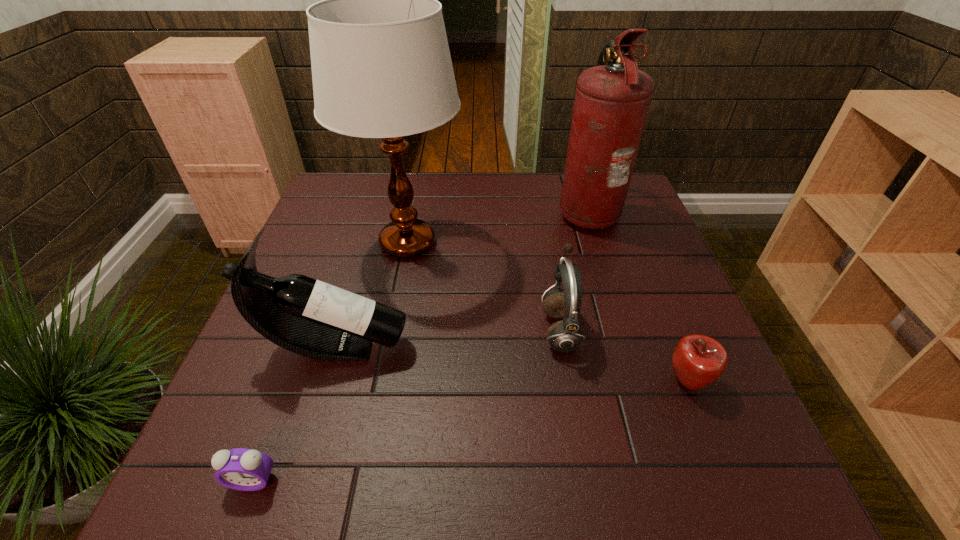
This screenshot has width=960, height=540. In order to click on blank space located at the front of the fire extinguisher where the nozzle is aimed in this screenshot , I will do `click(425, 211)`.

This screenshot has height=540, width=960. What are the coordinates of `vacant space located at the front of the fire extinguisher where the nozzle is aimed` in the screenshot? It's located at (510, 211).

I want to click on blank space located at the front of the fire extinguisher where the nozzle is aimed, so click(x=432, y=211).

You are a GUI agent. You are given a task and a screenshot of the screen. Output one action in this format:
    pyautogui.click(x=<x>, y=<y>)
    Task: Click on the free space located 0.100m on the stand of the fourth shortest object
    
    Given the screenshot: What is the action you would take?
    pyautogui.click(x=457, y=347)

I want to click on vacant space located 0.180m on the ear pads of the fourth tallest object, so click(460, 329).

Where is `vacant position located on the ear pads of the fourth tallest object`? This screenshot has height=540, width=960. vacant position located on the ear pads of the fourth tallest object is located at coordinates (446, 329).

The height and width of the screenshot is (540, 960). I want to click on vacant region located 0.100m on the ear pads of the fourth tallest object, so click(x=496, y=329).

Find the location of `free space located on the back of the fifth tallest object`. free space located on the back of the fifth tallest object is located at coordinates (658, 306).

What are the coordinates of `table lamp at the far edge` in the screenshot? It's located at (381, 66).

Image resolution: width=960 pixels, height=540 pixels. Identify the location of fire extinguisher that is at the far edge. (612, 100).